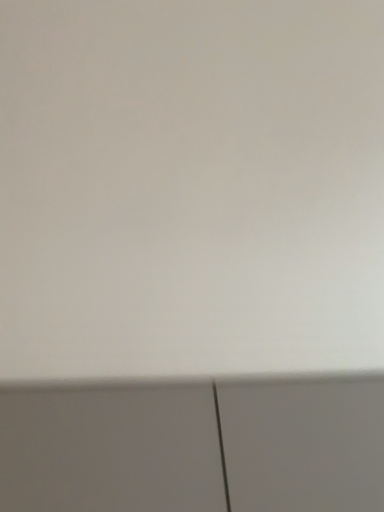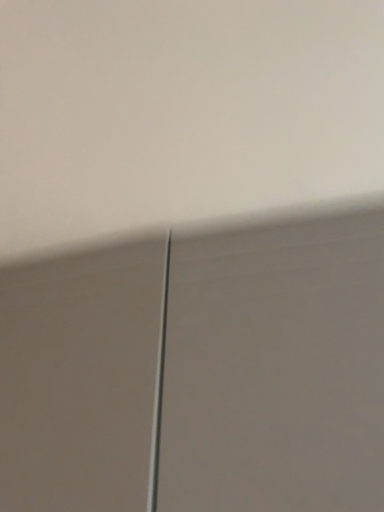
Question: Which way did the camera rotate in the video?

Choices:
 (A) rotated left
 (B) rotated right

Answer: (A)